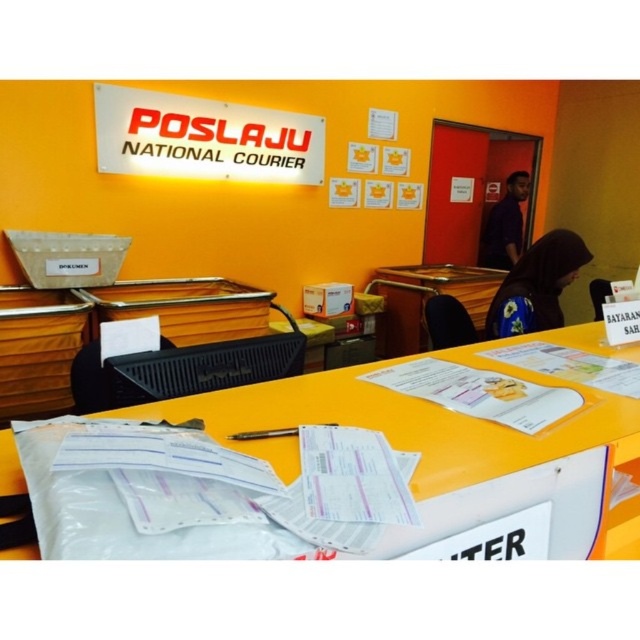
Question: Which of the following is the farthest from the observer?

Choices:
 (A) purple matte shirt at upper right
 (B) yellow plastic table at center

Answer: (A)

Question: Is purple matte shirt at upper right thinner than orange matte table at center?

Choices:
 (A) yes
 (B) no

Answer: (B)

Question: Which point appears closest to the camera in this image?

Choices:
 (A) (637, 444)
 (B) (486, 321)
 (C) (410, 353)

Answer: (A)

Question: Is floral fabric hijab at lower right to the left of orange matte table at center from the viewer's perspective?

Choices:
 (A) yes
 (B) no

Answer: (B)

Question: Where is yellow plastic table at center located in relation to orange matte table at center in the image?

Choices:
 (A) above
 (B) below

Answer: (A)

Question: Which object is farther from the camera taking this photo?

Choices:
 (A) yellow plastic table at center
 (B) floral fabric hijab at lower right
 (C) orange matte table at center

Answer: (A)